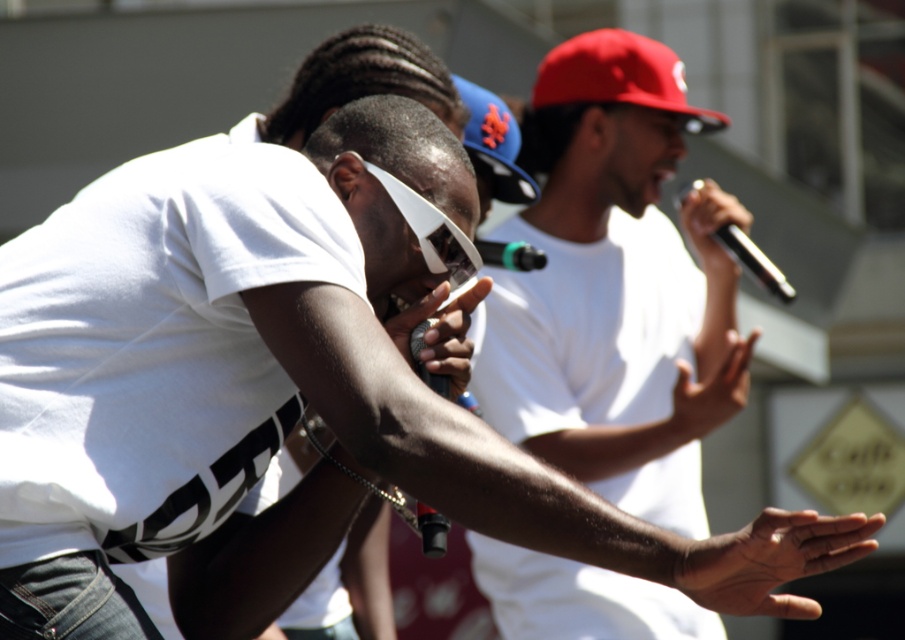
Is matte white shirt at center above black matte microphone at upper right?

No, matte white shirt at center is not above black matte microphone at upper right.

Is matte white shirt at center positioned at the back of black matte microphone at upper right?

No.

Does point (683, 625) come behind point (711, 252)?

No, (683, 625) is closer to viewer.

In order to click on matte white shirt at center in this screenshot , I will do `click(612, 289)`.

Is smooth skin hand at center wider than red matte baseball cap at upper right?

Incorrect, smooth skin hand at center's width does not surpass red matte baseball cap at upper right's.

In the scene shown: Is smooth skin hand at center shorter than red matte baseball cap at upper right?

Yes.

Locate an element on the screen. This screenshot has width=905, height=640. smooth skin hand at center is located at coordinates (770, 561).

Between point (780, 509) and point (465, 88), which one is positioned in front?

Positioned in front is point (780, 509).

Does point (755, 547) come behind point (474, 164)?

No.

What are the coordinates of `smooth skin hand at center` in the screenshot? It's located at (770, 561).

Where is `smooth skin hand at center`? The width and height of the screenshot is (905, 640). smooth skin hand at center is located at coordinates tap(770, 561).